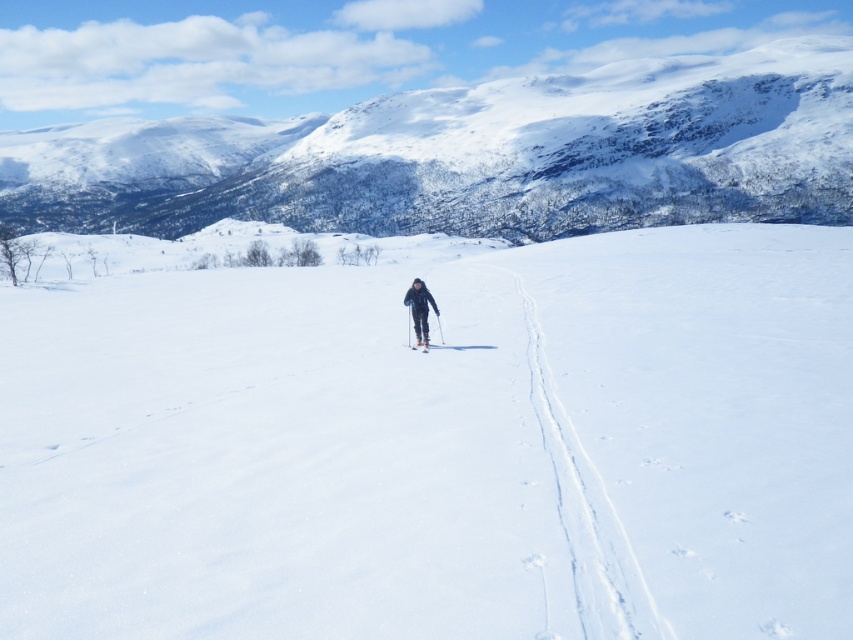
Who is higher up, black matte ski suit at center or white matte ski at center?

black matte ski suit at center

Does point (434, 312) come behind point (409, 346)?

That is False.

Is point (416, 310) farther from camera compared to point (427, 348)?

Yes, it is.

Find the location of a particular element. This screenshot has width=853, height=640. black matte ski suit at center is located at coordinates (419, 308).

Can you confirm if white snow ski slope at center is taller than snowy white mountain at upper center?

No, white snow ski slope at center is not taller than snowy white mountain at upper center.

Find the location of a particular element. white snow ski slope at center is located at coordinates (437, 444).

Does snowy white mountain at upper center come in front of white matte ski at center?

No, it is not.

Identify the location of snowy white mountain at upper center. (476, 156).

Between point (624, 147) and point (421, 344), which one is positioned in front?

Point (421, 344) is in front.

Locate an element on the screen. The image size is (853, 640). snowy white mountain at upper center is located at coordinates (x=476, y=156).